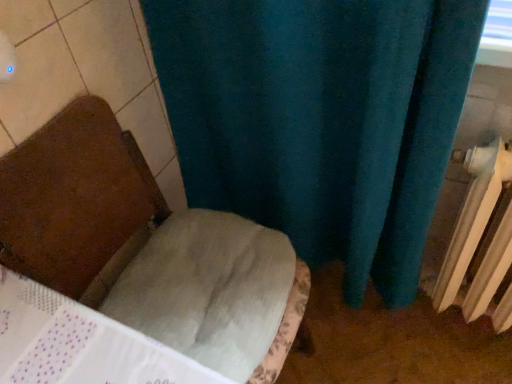
The height and width of the screenshot is (384, 512). Find the location of `white plastic radiator at right`. white plastic radiator at right is located at coordinates (480, 241).

Describe the element at coordinates (480, 241) in the screenshot. I see `white plastic radiator at right` at that location.

In order to face white fabric chair at center, should I rotate leftwards or rightwards?

You should look left and rotate roughly 8.817 degrees.

Describe the element at coordinates (77, 202) in the screenshot. I see `white fabric chair at center` at that location.

Find the location of a particular element. This screenshot has height=384, width=512. white fabric chair at center is located at coordinates (77, 202).

Image resolution: width=512 pixels, height=384 pixels. I want to click on white plastic radiator at right, so click(480, 241).

Is white plastic radiator at right at the right side of white fabric chair at center?

Indeed, white plastic radiator at right is positioned on the right side of white fabric chair at center.

Is white plastic radiator at right positioned in front of white fabric chair at center?

No, the depth of white plastic radiator at right is greater than that of white fabric chair at center.

Considering the positions of points (488, 187) and (96, 214), is point (488, 187) farther from camera compared to point (96, 214)?

No.

From the image's perspective, is white plastic radiator at right located beneath white fabric chair at center?

Incorrect, from the image's perspective, white plastic radiator at right is higher than white fabric chair at center.

From a real-world perspective, is white plastic radiator at right physically above white fabric chair at center?

No, from a real-world perspective, white plastic radiator at right is not over white fabric chair at center

Which of these two, white plastic radiator at right or white fabric chair at center, is wider?

white fabric chair at center is wider.

Is white plastic radiator at right taller or shorter than white fabric chair at center?

In the image, white plastic radiator at right appears to be shorter than white fabric chair at center.

Who is smaller, white plastic radiator at right or white fabric chair at center?

Smaller between the two is white plastic radiator at right.

Is white plastic radiator at right positioned beyond the bounds of white fabric chair at center?

white plastic radiator at right is positioned outside white fabric chair at center.

Is white plastic radiator at right next to white fabric chair at center?

No, white plastic radiator at right is not touching white fabric chair at center.

Is white plastic radiator at right oriented towards white fabric chair at center?

No.

Where is `radiator below the white fabric chair at center (from a real-world perspective)`? The image size is (512, 384). radiator below the white fabric chair at center (from a real-world perspective) is located at coordinates (480, 241).

Is white fabric chair at center at the right side of white plastic radiator at right?

In fact, white fabric chair at center is to the left of white plastic radiator at right.

Which is behind, white fabric chair at center or white plastic radiator at right?

white plastic radiator at right is behind.

Considering the positions of point (42, 179) and point (474, 226), is point (42, 179) closer or farther from the camera than point (474, 226)?

Point (42, 179) appears to be closer to the viewer than point (474, 226).

From the image's perspective, which is below, white fabric chair at center or white plastic radiator at right?

white fabric chair at center.

From a real-world perspective, is white fabric chair at center over white plastic radiator at right?

Yes.

Which of these two, white fabric chair at center or white plastic radiator at right, is wider?

white fabric chair at center is wider.

From their relative heights in the image, would you say white fabric chair at center is taller or shorter than white plastic radiator at right?

In the image, white fabric chair at center appears to be taller than white plastic radiator at right.

Which of these two, white fabric chair at center or white plastic radiator at right, is bigger?

Bigger between the two is white fabric chair at center.

Is white fabric chair at center located outside white plastic radiator at right?

Yes, white fabric chair at center is outside of white plastic radiator at right.

Are white fabric chair at center and white plastic radiator at right beside each other?

No, white fabric chair at center is not touching white plastic radiator at right.

Could you tell me if white fabric chair at center is facing white plastic radiator at right?

No, white fabric chair at center is not facing towards white plastic radiator at right.

Looking at this image, how many degrees apart are the facing directions of white fabric chair at center and white plastic radiator at right?

They differ by 89.1 degrees in their facing directions.

How distant is white fabric chair at center from white plastic radiator at right?

A distance of 83.03 centimeters exists between white fabric chair at center and white plastic radiator at right.

Where is `furniture on the left of white plastic radiator at right`? furniture on the left of white plastic radiator at right is located at coordinates (77, 202).

The width and height of the screenshot is (512, 384). Find the location of `radiator below the white fabric chair at center (from a real-world perspective)`. radiator below the white fabric chair at center (from a real-world perspective) is located at coordinates (480, 241).

This screenshot has height=384, width=512. In order to click on radiator that is behind the white fabric chair at center in this screenshot , I will do `click(480, 241)`.